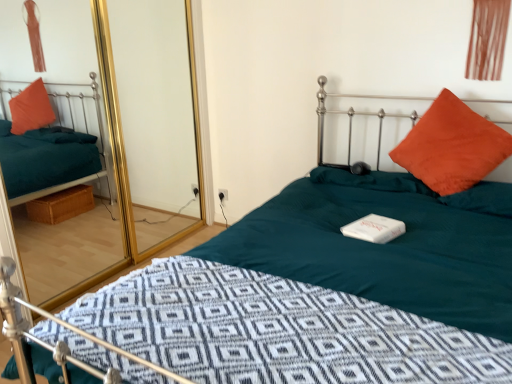
Question: Is orange suede pillow at upper right in contact with brown fabric curtain at upper right?

Choices:
 (A) yes
 (B) no

Answer: (B)

Question: Would you say brown fabric curtain at upper right is part of orange suede pillow at upper right's contents?

Choices:
 (A) yes
 (B) no

Answer: (B)

Question: From a real-world perspective, does orange suede pillow at upper right sit lower than brown fabric curtain at upper right?

Choices:
 (A) yes
 (B) no

Answer: (A)

Question: Is orange suede pillow at upper right closer to the viewer compared to brown fabric curtain at upper right?

Choices:
 (A) yes
 (B) no

Answer: (A)

Question: From the image's perspective, does orange suede pillow at upper right appear lower than brown fabric curtain at upper right?

Choices:
 (A) yes
 (B) no

Answer: (A)

Question: Is orange suede pillow at upper right thinner than brown fabric curtain at upper right?

Choices:
 (A) yes
 (B) no

Answer: (B)

Question: From the image's perspective, is orange suede pillow at upper right beneath transparent glass door at upper left?

Choices:
 (A) no
 (B) yes

Answer: (B)

Question: Can you confirm if orange suede pillow at upper right is positioned to the right of transparent glass door at upper left?

Choices:
 (A) no
 (B) yes

Answer: (B)

Question: Is orange suede pillow at upper right in front of transparent glass door at upper left?

Choices:
 (A) no
 (B) yes

Answer: (A)

Question: From the image's perspective, is orange suede pillow at upper right above transparent glass door at upper left?

Choices:
 (A) yes
 (B) no

Answer: (B)

Question: Considering the relative sizes of orange suede pillow at upper right and transparent glass door at upper left in the image provided, is orange suede pillow at upper right wider than transparent glass door at upper left?

Choices:
 (A) no
 (B) yes

Answer: (B)

Question: Can you confirm if orange suede pillow at upper right is bigger than transparent glass door at upper left?

Choices:
 (A) no
 (B) yes

Answer: (A)

Question: Is transparent glass door at upper left looking in the opposite direction of orange suede pillow at upper right?

Choices:
 (A) yes
 (B) no

Answer: (B)